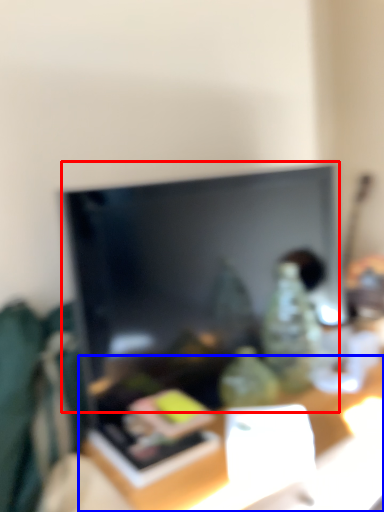
Question: Which point is closer to the camera, television (highlighted by a red box) or table (highlighted by a blue box)?

Choices:
 (A) television
 (B) table

Answer: (B)